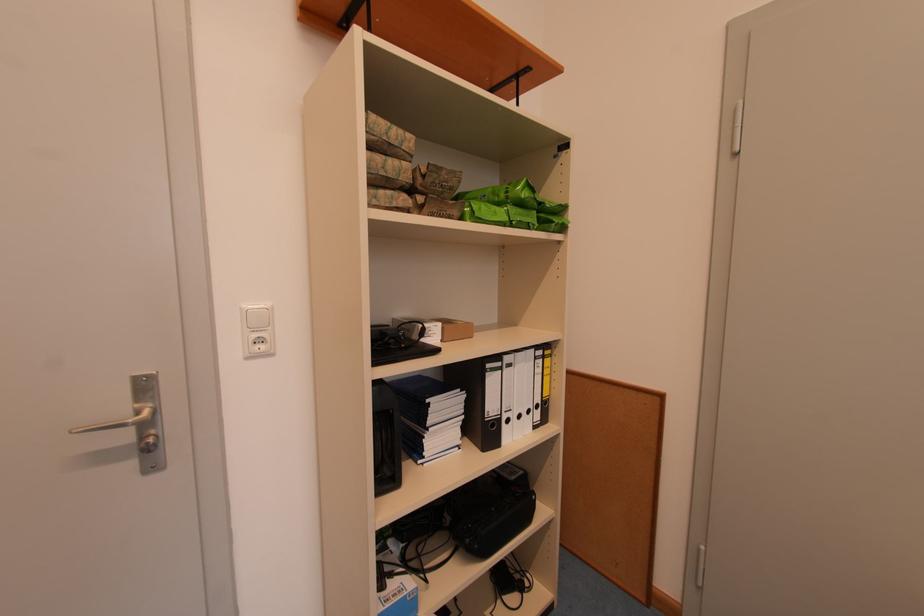
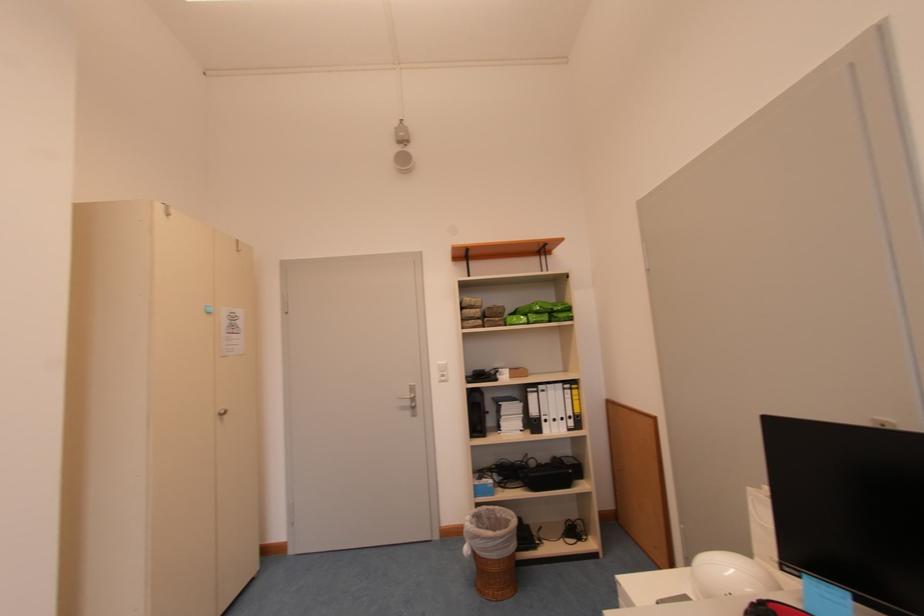
Find the pixel in the second image that matches pixel 516 424 in the first image.

(553, 424)